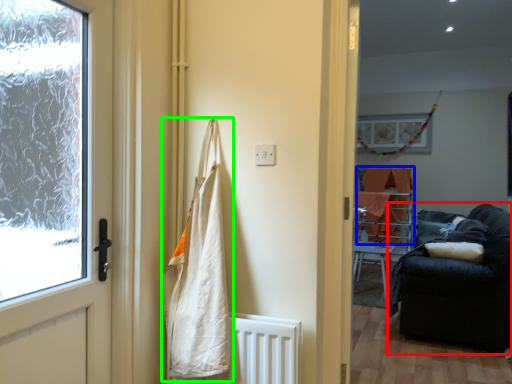
Question: Which is nearer to the studio couch (highlighted by a red box)? blanket (highlighted by a blue box) or shopping bag (highlighted by a green box).

Choices:
 (A) blanket
 (B) shopping bag

Answer: (A)